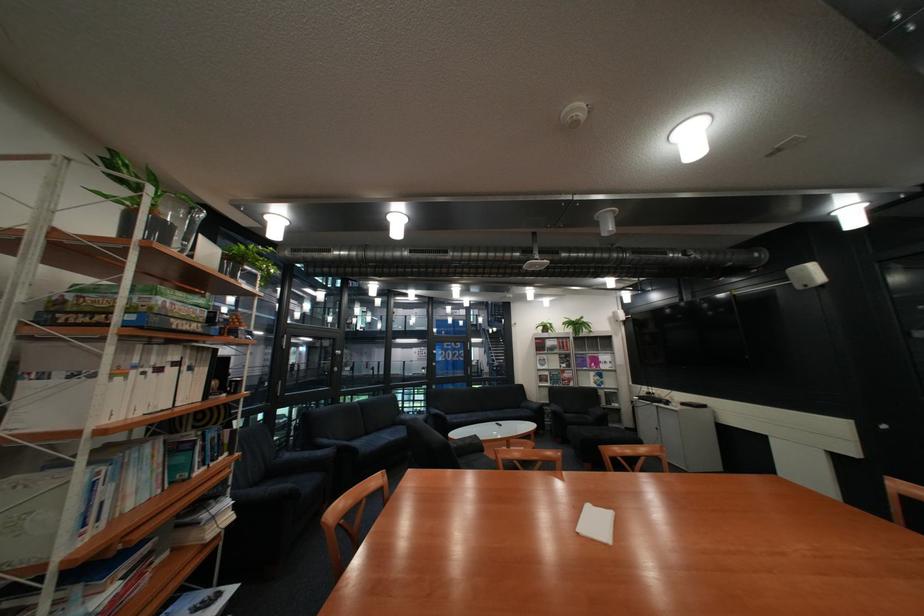
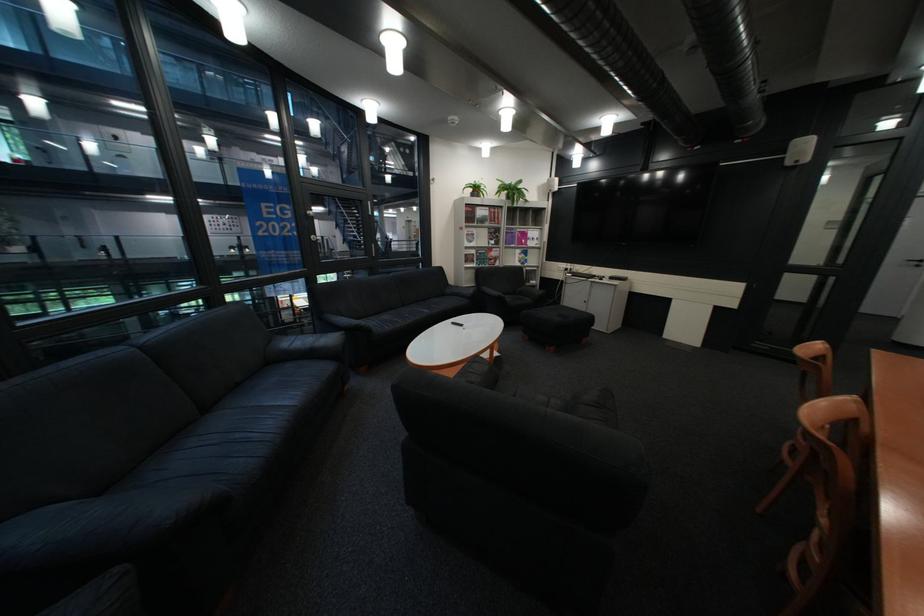
Where in the second image is the point corresponding to [552,339] from the first image?

(481, 205)